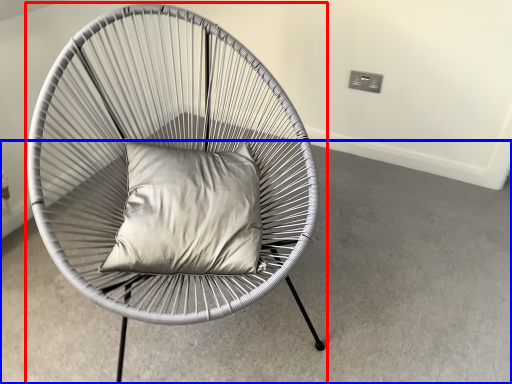
Question: Which of the following is the closest to the observer, chair (highlighted by a red box) or concrete (highlighted by a blue box)?

Choices:
 (A) chair
 (B) concrete

Answer: (A)